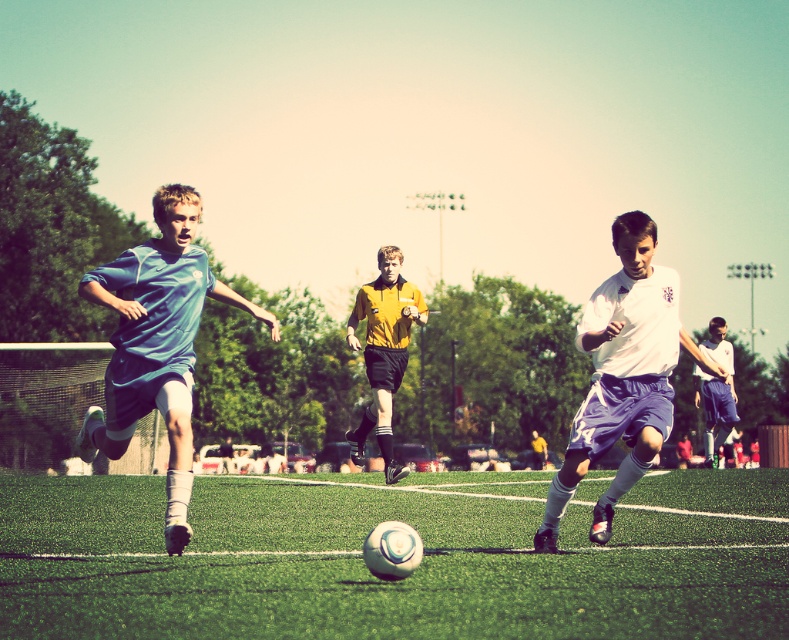
In the scene shown: You are a soccer coach analyzing the positions of two key players during a match. The first player is at point (582, 436) and the second is at point (709, 465). Based on their positions, which player is closer to the camera?

Point (582, 436) is closer to the camera than point (709, 465).

You are a soccer coach analyzing the game. You notice two players wearing a yellow matte shirt at center and a white jersey at center. Which player has a wider torso based on their clothing?

The white jersey at center has a wider torso since its width is greater than the yellow matte shirt at center.

You are a soccer coach observing the game and want to give instructions to the yellow matte shirt at center and the white jersey at center. Which player should you tell to move to the right to avoid blocking each other?

The yellow matte shirt at center is positioned on the left side of white jersey at center, so you should tell the yellow matte shirt at center to move to the right to avoid blocking each other.